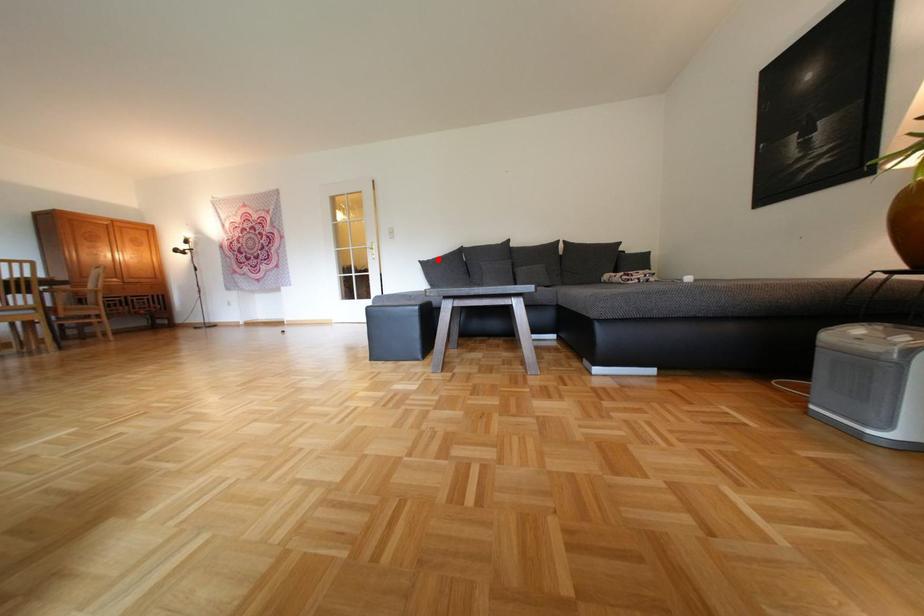
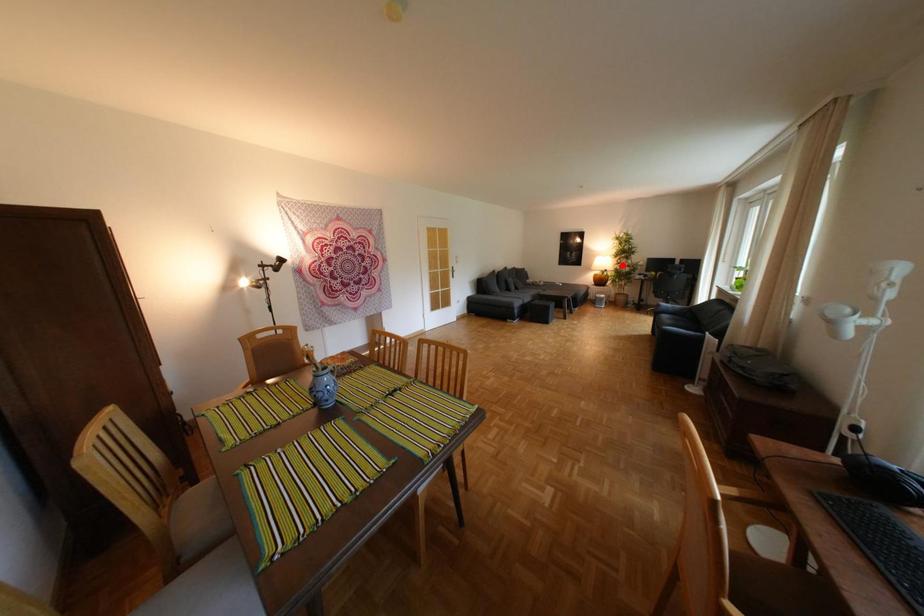
I am providing you with two images of the same scene from different viewpoints. A red point is marked on the first image and another point is marked on the second image. Are the points marked in image1 and image2 representing the same 3D position?

No